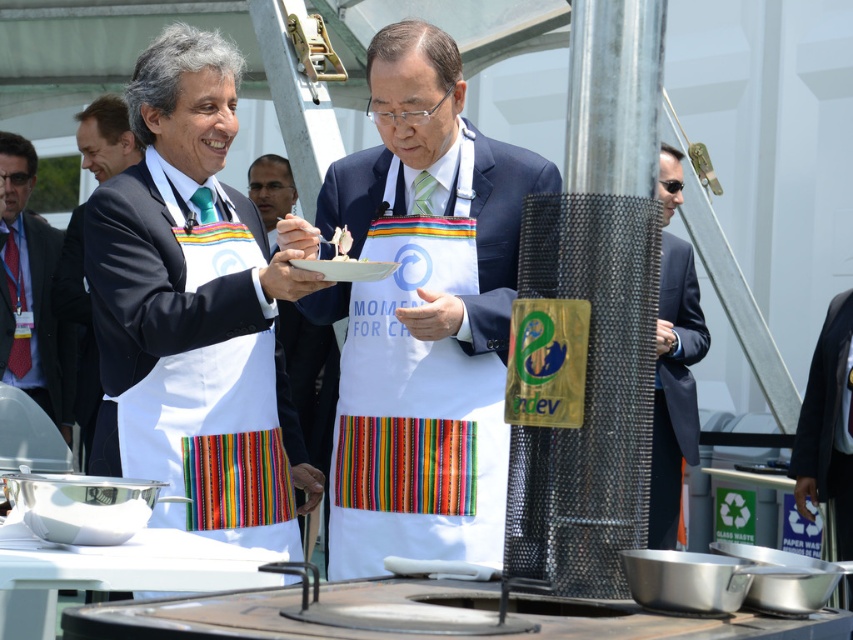
You are standing at the cooking station and want to place a new ingredient between the two points, point 1 at point (363, 522) and point 2 at point (322, 264). Since you want the ingredient to be closer to you, which point should you position it closer to?

Point 1 at point (363, 522) is closer to you than point 2 at point (322, 264), so you should position the ingredient closer to point 1 to keep it nearer.

You are at the cooking station and need to locate the matte white apron at center. According to the coordinates provided, where should you look?

The matte white apron at center is located at point (78,324).